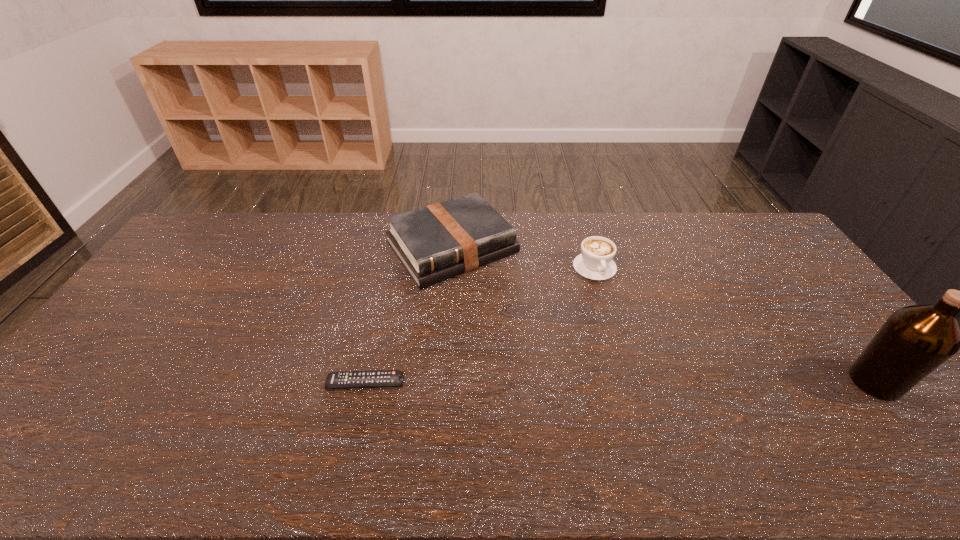
This screenshot has height=540, width=960. What are the coordinates of `vacant space on the desktop that is between the remote control and the rightmost object and is positioned to the right of the second object from right to left's handle` in the screenshot? It's located at (649, 382).

Locate an element on the screen. free space on the desktop that is between the shortest object and the rightmost object and is positioned on the spine side of the hardback book is located at coordinates (566, 382).